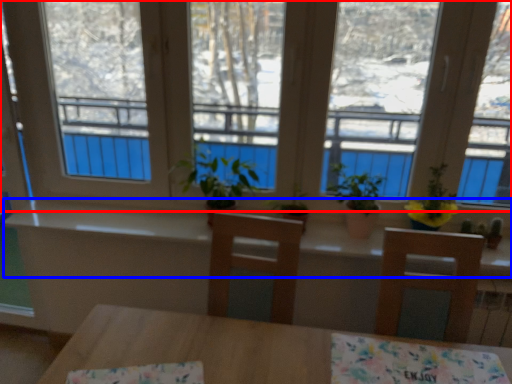
Question: Among these objects, which one is farthest to the camera, window (highlighted by a red box) or counter top (highlighted by a blue box)?

Choices:
 (A) window
 (B) counter top

Answer: (B)